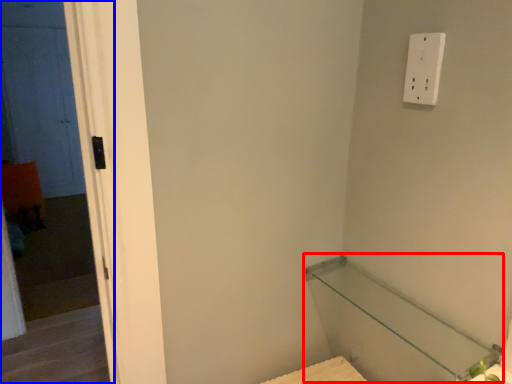
Question: Which object is closer to the camera taking this photo, balustrade (highlighted by a red box) or screen door (highlighted by a blue box)?

Choices:
 (A) balustrade
 (B) screen door

Answer: (A)